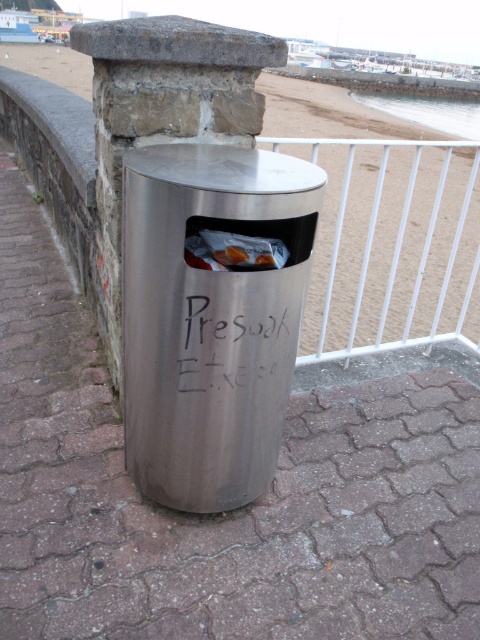
Question: Can you confirm if stainless steel trash can at center is bigger than silver metallic trash can at center?

Choices:
 (A) yes
 (B) no

Answer: (B)

Question: Can you confirm if stainless steel trash can at center is positioned below black matte graffiti at center?

Choices:
 (A) yes
 (B) no

Answer: (B)

Question: Among these points, which one is farthest from the camera?

Choices:
 (A) (222, 257)
 (B) (286, 330)
 (C) (384, 273)
 (D) (151, 384)

Answer: (C)

Question: Estimate the real-world distances between objects in this image. Which object is closer to the stainless steel trash can at center?

Choices:
 (A) silver metallic trash can at center
 (B) black matte graffiti at center
 (C) translucent plastic bag at center

Answer: (B)

Question: Is black matte graffiti at center above translucent plastic bag at center?

Choices:
 (A) yes
 (B) no

Answer: (B)

Question: Which point appears farthest from the camera in this image?

Choices:
 (A) (238, 214)
 (B) (263, 246)
 (C) (407, 246)

Answer: (C)